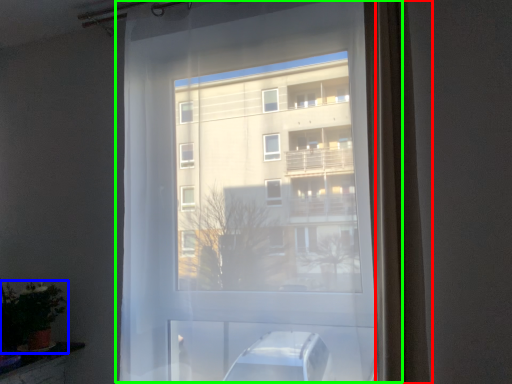
Question: Which object is positioned closest to curtain (highlighted by a red box)? Select from houseplant (highlighted by a blue box) and window (highlighted by a green box).

Choices:
 (A) houseplant
 (B) window

Answer: (B)